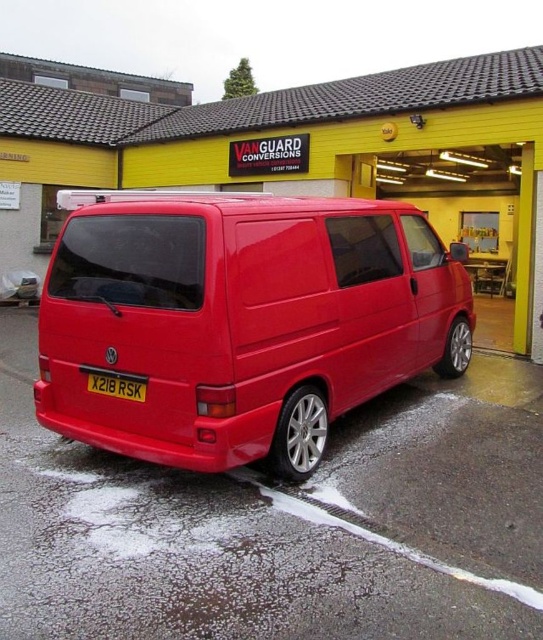
Question: Which point appears farthest from the camera in this image?

Choices:
 (A) (132, 333)
 (B) (104, 385)

Answer: (B)

Question: Is glossy red van at center closer to the viewer compared to yellow matte license plate at rear?

Choices:
 (A) no
 (B) yes

Answer: (B)

Question: Can you confirm if glossy red van at center is thinner than yellow matte license plate at rear?

Choices:
 (A) yes
 (B) no

Answer: (B)

Question: Which object is farther from the camera taking this photo?

Choices:
 (A) glossy red van at center
 (B) yellow matte license plate at rear

Answer: (B)

Question: Does glossy red van at center appear on the right side of yellow matte license plate at rear?

Choices:
 (A) yes
 (B) no

Answer: (A)